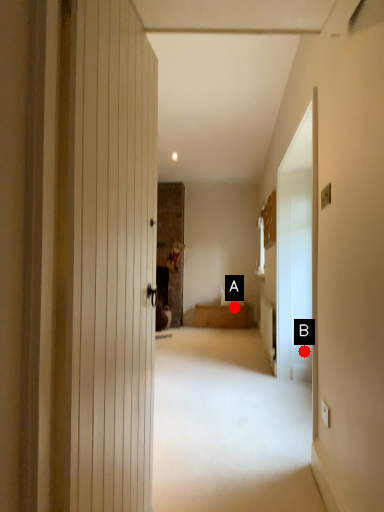
Question: Two points are circled on the image, labeled by A and B beside each circle. Which point appears farthest from the camera in this image?

Choices:
 (A) A is further
 (B) B is further

Answer: (A)